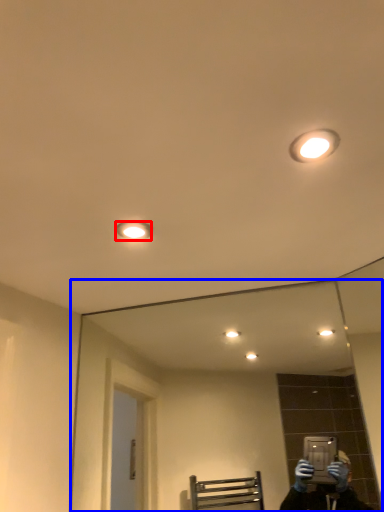
Question: Which of the following is the farthest to the observer, light fixture (highlighted by a red box) or mirror (highlighted by a blue box)?

Choices:
 (A) light fixture
 (B) mirror

Answer: (B)